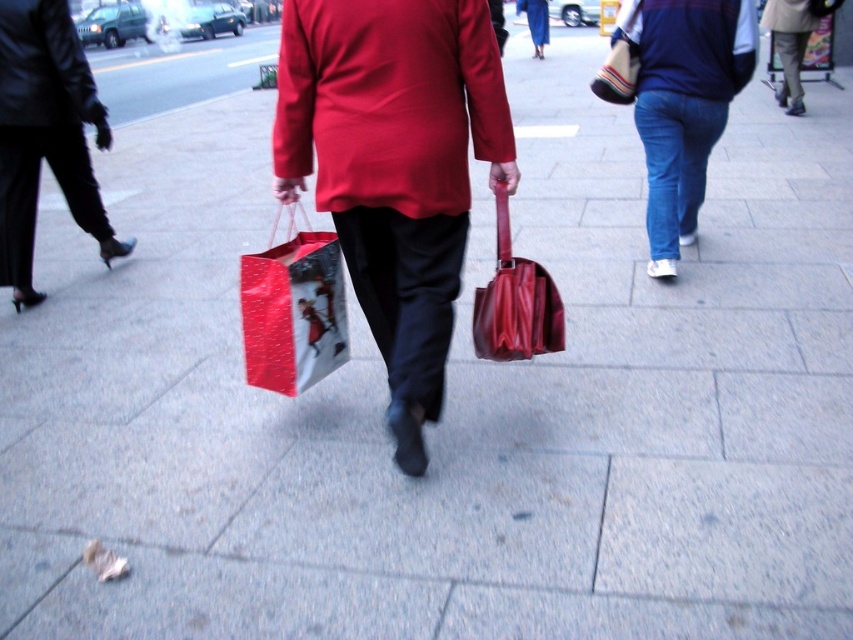
You are a delivery person who needs to deliver a package to the person wearing the black leather jacket at left. The package is too large to carry, so you have to place it on the ground. Where should you put it so that it won not be in the way of the shiny paper bag at center?

Place the package to the left of the black leather jacket at left, since the shiny paper bag at center is already to the right of the black leather jacket at left and placing it there would block the shiny paper bag at center.

You are a fashion designer observing the scene. You need to determine which item, the black leather pants at left or the striped fabric bag at upper right, would require more fabric to produce. Based on the scene, which one would you choose?

The black leather pants at left is bigger than the striped fabric bag at upper right, so it would require more fabric to produce.

You are a delivery person who needs to place a rectangular box that is 15 cm wide between the shiny paper bag at center and the black leather jacket at left. Based on their widths, can the box fit between them without overlapping either object?

The shiny paper bag at center is narrower than the black leather jacket at left. Since the box is 15 cm wide, it depends on the available space between them. However, since the description only provides relative width comparisons and not the exact distance between the objects, we cannot determine if the box will fit solely based on the given information.